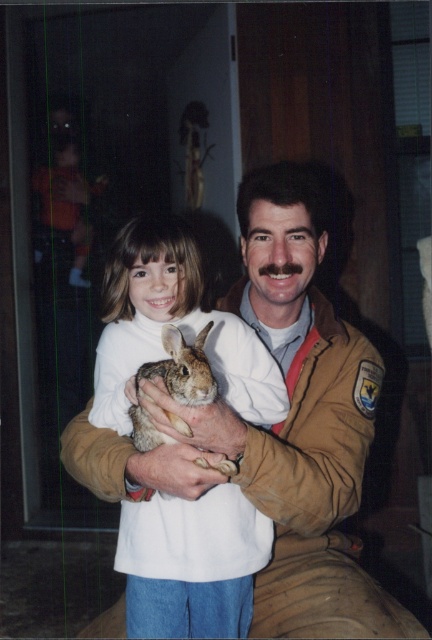
Which is below, white soft turtleneck at center or fuzzy brown rabbit at center?

white soft turtleneck at center is lower down.

Find the location of a particular element. The width and height of the screenshot is (432, 640). white soft turtleneck at center is located at coordinates (x=174, y=324).

I want to click on white soft turtleneck at center, so click(174, 324).